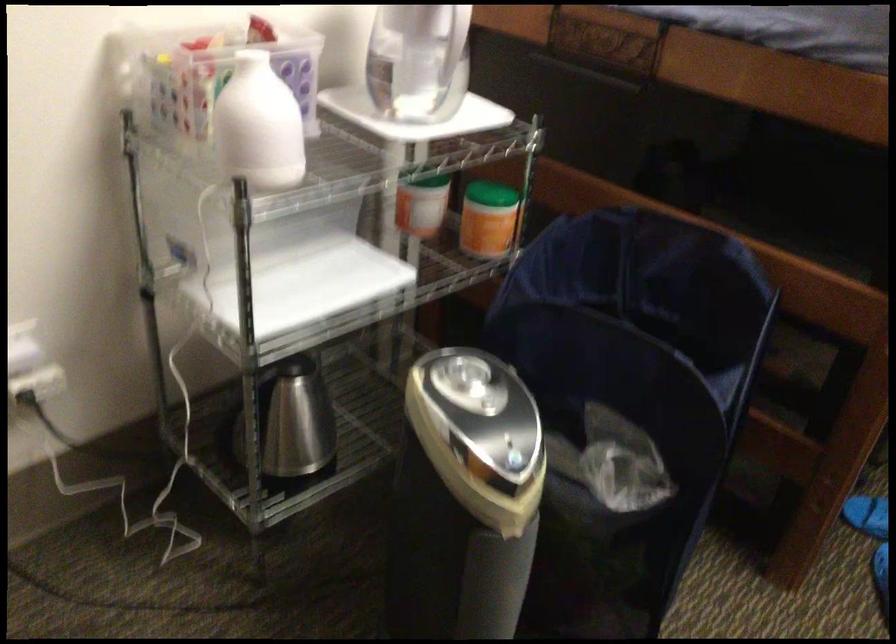
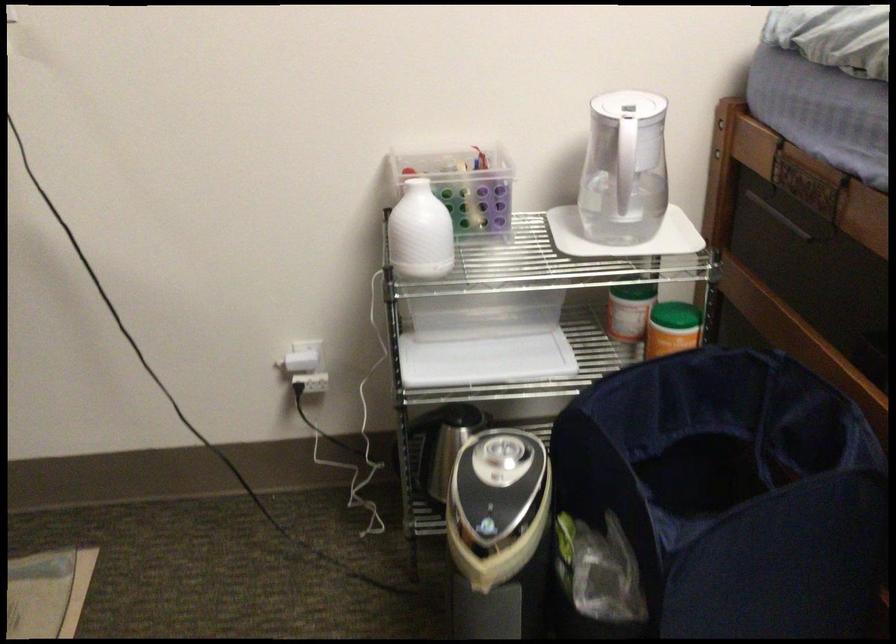
In the second image, find the point that corresponds to pixel 530 460 in the first image.

(498, 534)